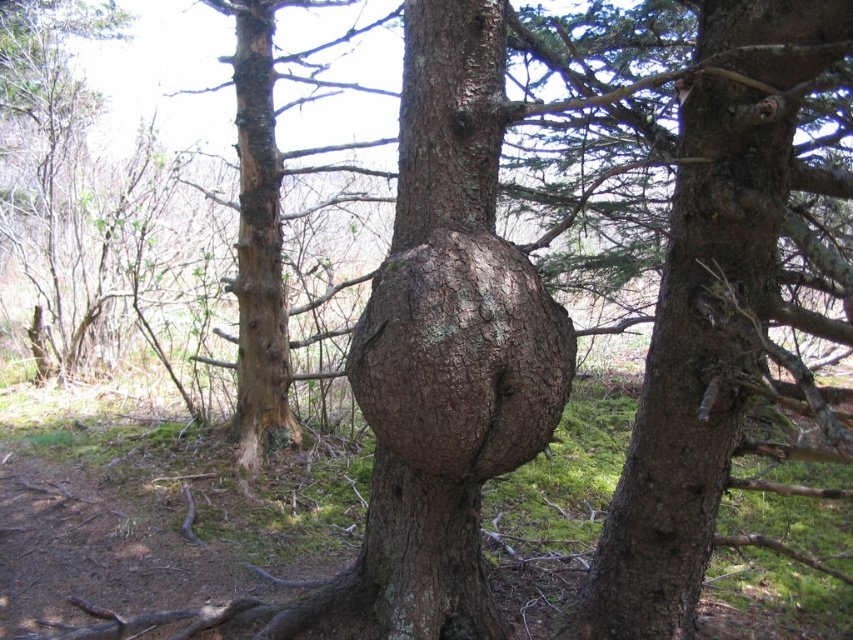
Question: Is brown rough bark at center thinner than brown rough bark tree trunk at left?

Choices:
 (A) no
 (B) yes

Answer: (A)

Question: Which point appears closest to the camera in this image?

Choices:
 (A) (488, 260)
 (B) (281, 394)

Answer: (A)

Question: Is brown rough bark at center smaller than brown rough bark tree trunk at left?

Choices:
 (A) no
 (B) yes

Answer: (B)

Question: Observing the image, what is the correct spatial positioning of brown rough bark at center in reference to brown rough bark tree trunk at left?

Choices:
 (A) above
 (B) below

Answer: (B)

Question: Among these points, which one is farthest from the camera?

Choices:
 (A) (260, 51)
 (B) (434, 388)

Answer: (A)